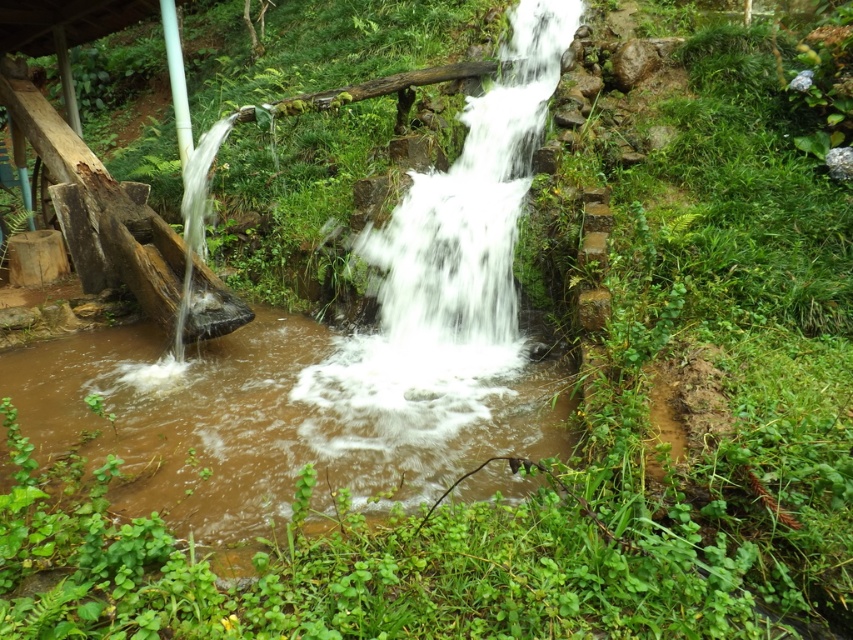
Based on the photo, who is taller, brown muddy water at center or white frothy water at center?

Standing taller between the two is white frothy water at center.

Between brown muddy water at center and white frothy water at center, which one has less height?

Standing shorter between the two is brown muddy water at center.

You are a GUI agent. You are given a task and a screenshot of the screen. Output one action in this format:
    pyautogui.click(x=<x>, y=<y>)
    Task: Click on the brown muddy water at center
    This screenshot has width=853, height=640.
    Given the screenshot: What is the action you would take?
    pyautogui.click(x=279, y=417)